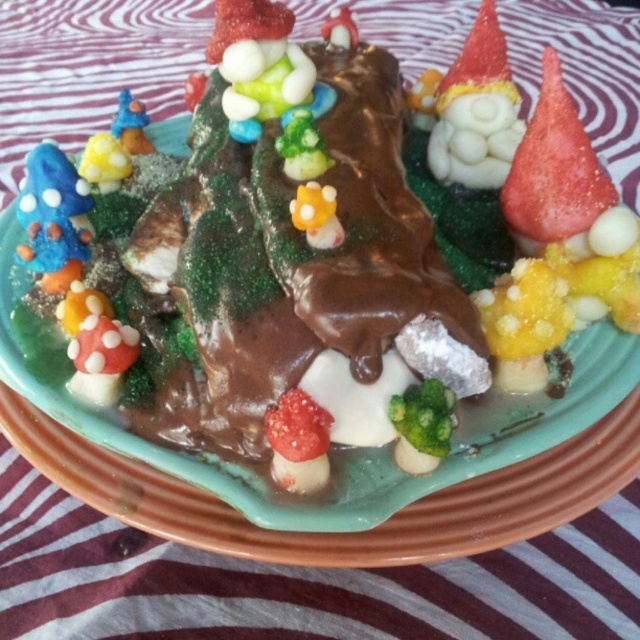
Question: Does strawberry at center appear over red matte strawberry at center?

Choices:
 (A) yes
 (B) no

Answer: (A)

Question: Is strawberry at center wider than red matte strawberry at center?

Choices:
 (A) yes
 (B) no

Answer: (A)

Question: Does strawberry at center have a larger size compared to red matte strawberry at center?

Choices:
 (A) no
 (B) yes

Answer: (B)

Question: Which object is closer to the camera taking this photo?

Choices:
 (A) strawberry at center
 (B) red matte strawberry at center

Answer: (B)